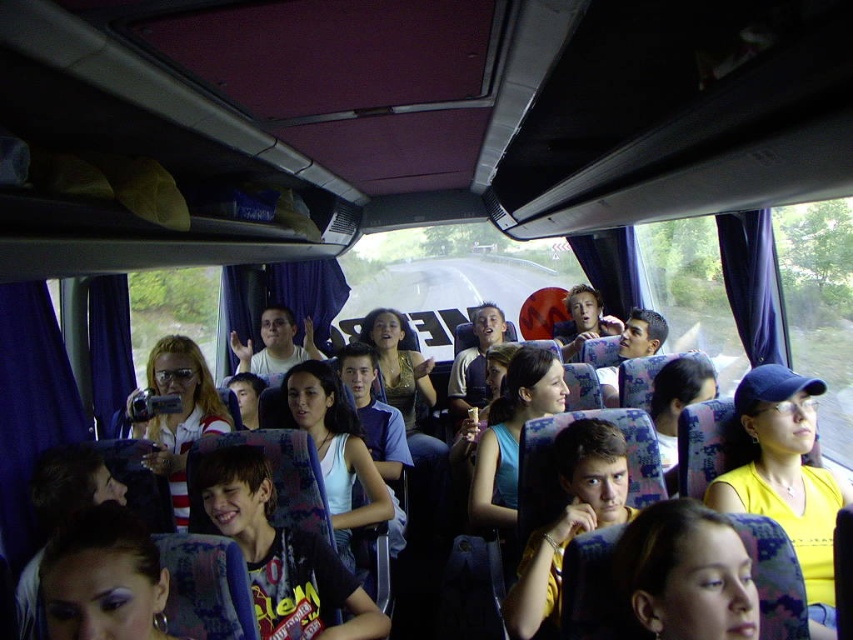
You are a passenger sitting in the bus and you see the yellow matte shirt at center and the smooth yellow shirt at lower right. Which one is positioned more to the right side of the bus?

The yellow matte shirt at center is positioned more to the right side of the bus than the smooth yellow shirt at lower right.

You are a passenger on a bus and want to find a seat. You notice two yellow shirts among the passengers. The yellow matte shirt at center and the smooth yellow shirt at lower right. Which of these two shirts is bigger in size?

The yellow matte shirt at center is larger in size compared to the smooth yellow shirt at lower right.

You are a bus passenger trying to find a seat. You see two yellow shirts in the scene. The yellow matte shirt at center and the smooth yellow shirt at lower right. Which one is wider?

The yellow matte shirt at center is wider than the smooth yellow shirt at lower right.